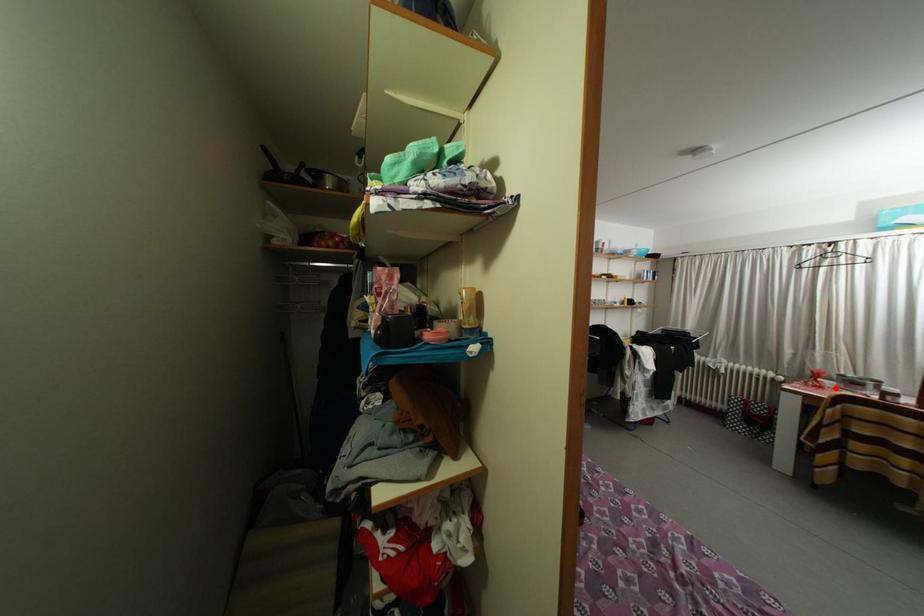
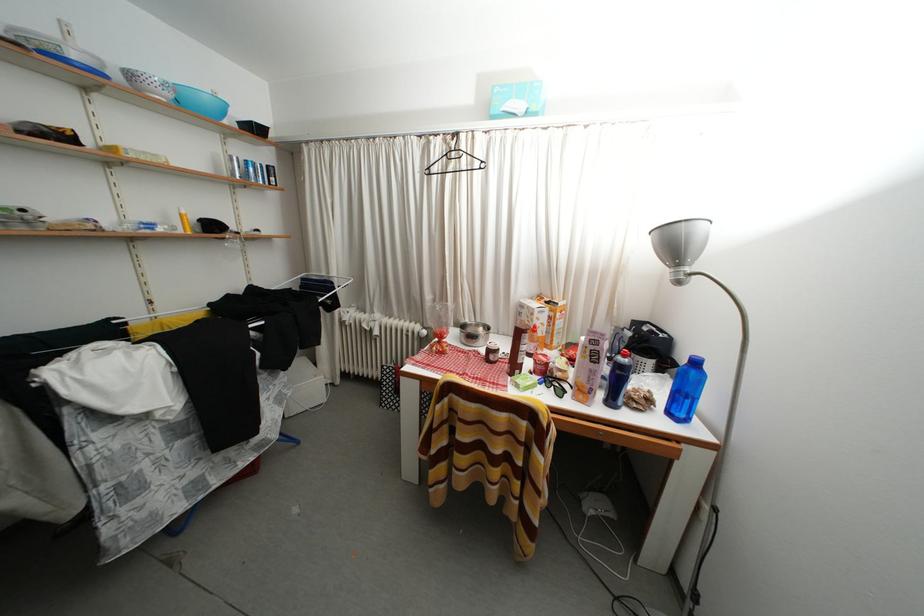
In the second image, find the point that corresponds to the highlighted location in the first image.

(460, 342)